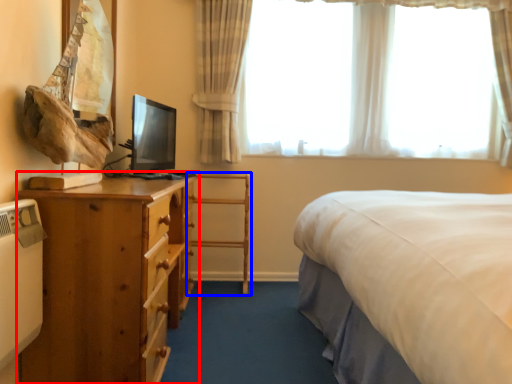
Question: Among these objects, which one is farthest to the camera, nightstand (highlighted by a red box) or chair (highlighted by a blue box)?

Choices:
 (A) nightstand
 (B) chair

Answer: (B)